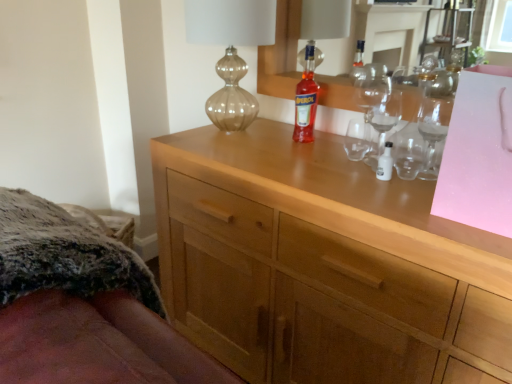
Question: Do you think fuzzy fabric bed at lower left is within translucent glass bottle at center, or outside of it?

Choices:
 (A) outside
 (B) inside

Answer: (A)

Question: Is fuzzy fabric bed at lower left wider or thinner than translucent glass bottle at center?

Choices:
 (A) thin
 (B) wide

Answer: (B)

Question: Estimate the real-world distances between objects in this image. Which object is closer to the light wood cabinet at center?

Choices:
 (A) fuzzy fabric bed at lower left
 (B) translucent glass bottle at center
 (C) transparent glass wine glass at upper right
 (D) translucent glass vase at upper center

Answer: (C)

Question: Which object is positioned farthest from the light wood cabinet at center?

Choices:
 (A) fuzzy fabric bed at lower left
 (B) translucent glass bottle at center
 (C) transparent glass wine glass at upper right
 (D) translucent glass vase at upper center

Answer: (D)